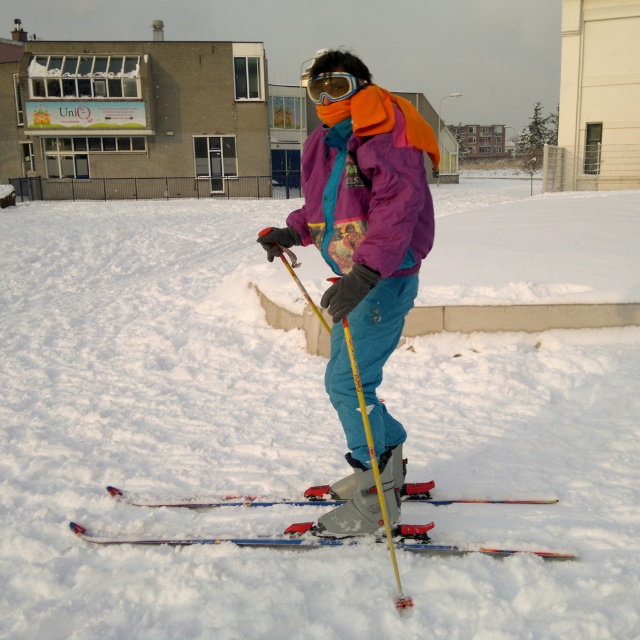
You are a photographer trying to capture the yellow plastic ski pole at center and the white fluffy snow at center in the same frame. Based on their positions, which one should you focus on first to ensure both are in focus?

The white fluffy snow at center is located above the yellow plastic ski pole at center, so you should focus on the yellow plastic ski pole at center first to ensure both are in focus.

Consider the image. You are a photographer trying to capture the skier in the image. The skier is wearing a purple fleece jacket at center. Your camera has a zoom lens that can focus on a specific point. The point you want to focus on is at coordinates point (368, 186). Can you confirm if this point corresponds to the purple fleece jacket at center?

Yes, the point (368, 186) corresponds to the purple fleece jacket at center as stated in the objects description.